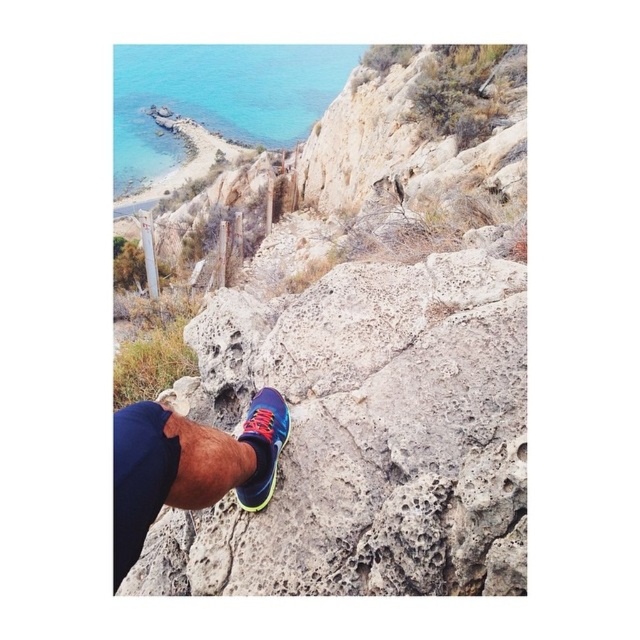
Is rough textured rock at center wider than turquoise glossy water at upper left?

No.

Does point (516, 305) come in front of point (180, 140)?

Yes, it is in front of point (180, 140).

Which is behind, point (468, 253) or point (140, 186)?

The point (140, 186) is more distant.

The height and width of the screenshot is (640, 640). What are the coordinates of `rough textured rock at center` in the screenshot? It's located at (376, 355).

Measure the distance between point (129, 172) and camera.

The distance of point (129, 172) from camera is 56.50 meters.

From the picture: Is turquoise glossy water at upper left below shiny blue running shoe at center?

Incorrect, turquoise glossy water at upper left is not positioned below shiny blue running shoe at center.

Where is `turquoise glossy water at upper left`? turquoise glossy water at upper left is located at coordinates (216, 99).

Between rough textured rock at center and shiny blue running shoe at lower center, which one appears on the right side from the viewer's perspective?

Answer: Positioned to the right is shiny blue running shoe at lower center.

Is point (461, 323) positioned before point (268, 480)?

No, it is behind (268, 480).

The width and height of the screenshot is (640, 640). What are the coordinates of `rough textured rock at center` in the screenshot? It's located at (376, 355).